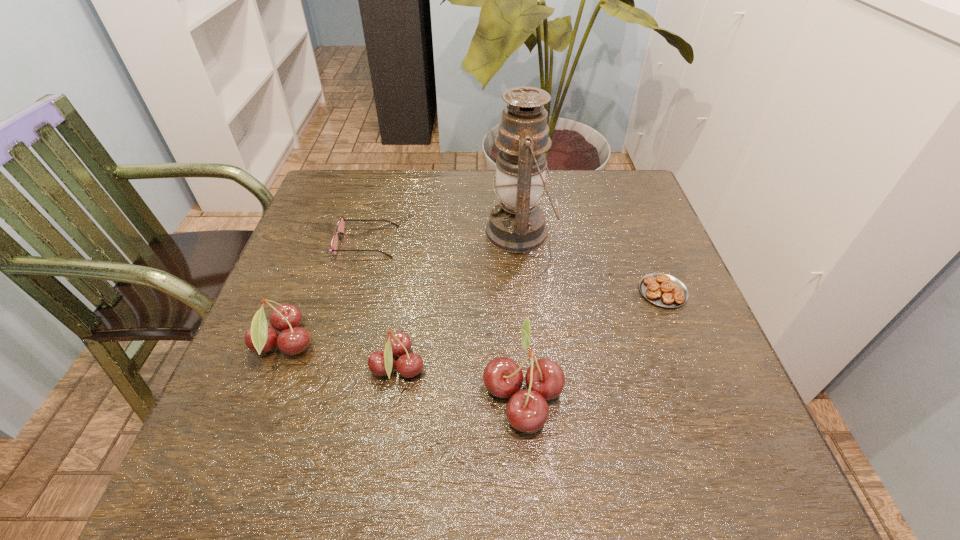
Where is `the leftmost cherry`? The width and height of the screenshot is (960, 540). the leftmost cherry is located at coordinates (286, 318).

Image resolution: width=960 pixels, height=540 pixels. Find the location of `the third tallest object`. the third tallest object is located at coordinates (286, 318).

The width and height of the screenshot is (960, 540). Find the location of `the second cherry from left to right`. the second cherry from left to right is located at coordinates (398, 344).

The width and height of the screenshot is (960, 540). I want to click on the third object from left to right, so [x=398, y=344].

At what (x,y) coordinates should I click in order to perform the action: click on the rightmost cherry. Please return your answer as a coordinate pair (x, y). Image resolution: width=960 pixels, height=540 pixels. Looking at the image, I should click on (527, 411).

Locate an element on the screen. The width and height of the screenshot is (960, 540). the tallest object is located at coordinates (517, 225).

This screenshot has width=960, height=540. In order to click on pastry in this screenshot , I will do `click(664, 290)`.

Where is `the shortest object`? The width and height of the screenshot is (960, 540). the shortest object is located at coordinates (664, 290).

Identify the location of sunglasses. (341, 223).

At what (x,y) coordinates should I click in order to perform the action: click on vacant space located on the leaves of the third tallest object. Please return your answer as a coordinate pair (x, y). Looking at the image, I should click on tap(503, 345).